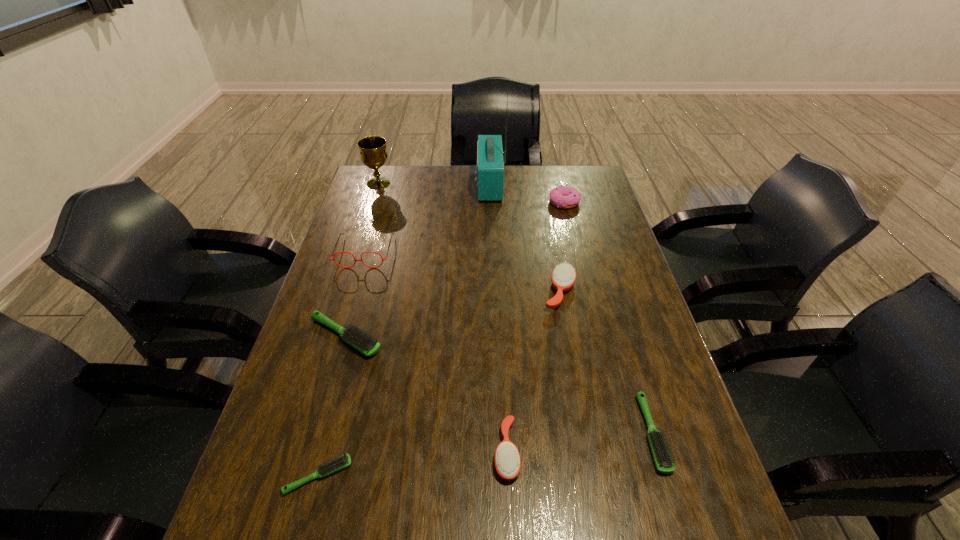
The height and width of the screenshot is (540, 960). Identify the location of vacant region located 0.270m on the front of the eighth shortest object. (362, 235).

This screenshot has height=540, width=960. Find the location of `free location located 0.140m on the front-facing side of the sixth nearest object`. free location located 0.140m on the front-facing side of the sixth nearest object is located at coordinates (350, 302).

Where is `vacant area situated on the left of the bigger orange hairbrush`? vacant area situated on the left of the bigger orange hairbrush is located at coordinates (402, 292).

This screenshot has width=960, height=540. In order to click on vacant position located on the left of the doughnut in this screenshot , I will do `click(460, 202)`.

You are a GUI agent. You are given a task and a screenshot of the screen. Output one action in this format:
    pyautogui.click(x=<x>, y=<y>)
    Task: Click on the free spot located 0.060m on the right of the farthest light hairbrush
    This screenshot has height=540, width=960.
    Given the screenshot: What is the action you would take?
    pyautogui.click(x=407, y=336)

At what (x,y) coordinates should I click in order to perform the action: click on free location located on the right of the nearer orange hairbrush. Please return your answer as a coordinate pair (x, y). This screenshot has width=960, height=540. Looking at the image, I should click on (678, 451).

Image resolution: width=960 pixels, height=540 pixels. I want to click on free space located 0.060m on the right of the rightmost light hairbrush, so click(x=689, y=434).

Locate an element on the screen. free space located on the back of the shortest hairbrush is located at coordinates (329, 433).

Locate an element on the screen. This screenshot has height=540, width=960. radio receiver at the far edge is located at coordinates (490, 166).

Locate an element on the screen. The width and height of the screenshot is (960, 540). chalice present at the far edge is located at coordinates (373, 154).